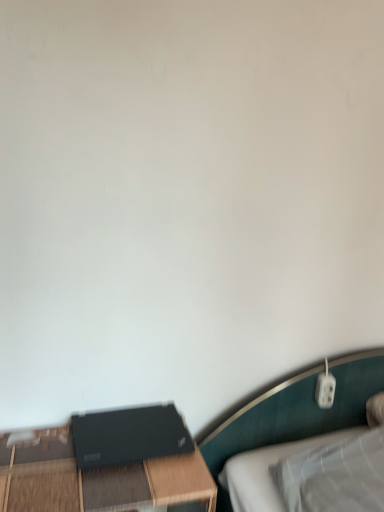
Identify the location of vacant area on top of black matte table at lower left (from a real-world perspective). (87, 464).